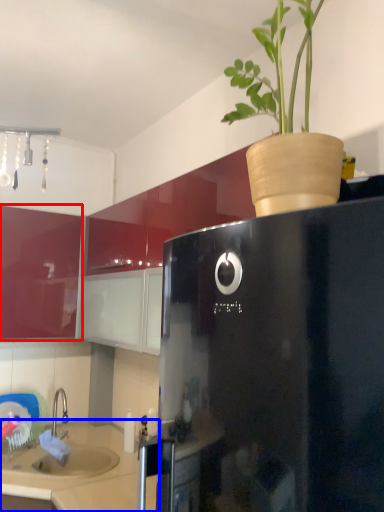
Question: Which object appears farthest to the camera in this image, cabinetry (highlighted by a red box) or counter top (highlighted by a blue box)?

Choices:
 (A) cabinetry
 (B) counter top

Answer: (A)